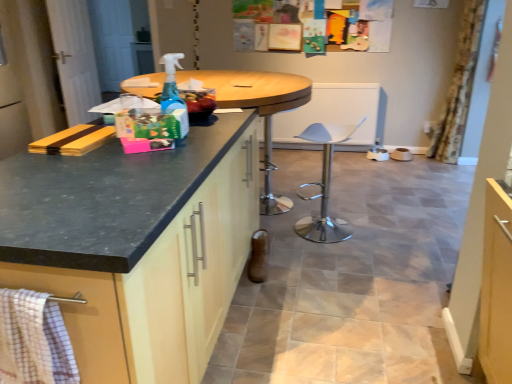
Question: Can you confirm if checkered fabric towel at lower left is smaller than matte black countertop at left?

Choices:
 (A) no
 (B) yes

Answer: (B)

Question: Is checkered fabric towel at lower left outside matte black countertop at left?

Choices:
 (A) yes
 (B) no

Answer: (A)

Question: Are checkered fabric towel at lower left and matte black countertop at left far apart?

Choices:
 (A) no
 (B) yes

Answer: (A)

Question: Does checkered fabric towel at lower left have a greater width compared to matte black countertop at left?

Choices:
 (A) no
 (B) yes

Answer: (A)

Question: From the image's perspective, does checkered fabric towel at lower left appear higher than matte black countertop at left?

Choices:
 (A) no
 (B) yes

Answer: (A)

Question: Is point (92, 102) closer or farther from the camera than point (266, 89)?

Choices:
 (A) farther
 (B) closer

Answer: (A)

Question: Is white wood screen door at left inside or outside of wooden table at center?

Choices:
 (A) outside
 (B) inside

Answer: (A)

Question: Based on their sizes in the image, would you say white wood screen door at left is bigger or smaller than wooden table at center?

Choices:
 (A) big
 (B) small

Answer: (B)

Question: Is white wood screen door at left taller or shorter than wooden table at center?

Choices:
 (A) short
 (B) tall

Answer: (B)

Question: Is white wood screen door at left wider or thinner than checkered fabric towel at lower left?

Choices:
 (A) wide
 (B) thin

Answer: (B)

Question: In terms of size, does white wood screen door at left appear bigger or smaller than checkered fabric towel at lower left?

Choices:
 (A) big
 (B) small

Answer: (A)

Question: From a real-world perspective, relative to checkered fabric towel at lower left, is white wood screen door at left vertically above or below?

Choices:
 (A) above
 (B) below

Answer: (A)

Question: Which is correct: white wood screen door at left is inside checkered fabric towel at lower left, or outside of it?

Choices:
 (A) outside
 (B) inside

Answer: (A)

Question: Relative to matte black countertop at left, is checkered fabric towel at lower left in front or behind?

Choices:
 (A) behind
 (B) front

Answer: (A)

Question: Is checkered fabric towel at lower left wider or thinner than matte black countertop at left?

Choices:
 (A) thin
 (B) wide

Answer: (A)